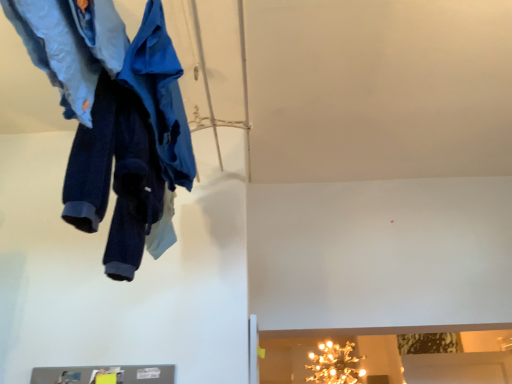
Question: From the image's perspective, is navy blue fleece pants at upper left, which is the second trousers from front to back, positioned above or below blue fabric coat at upper left?

Choices:
 (A) below
 (B) above

Answer: (A)

Question: Do you think navy blue fleece pants at upper left, which is the second trousers from front to back, is within blue fabric coat at upper left, or outside of it?

Choices:
 (A) inside
 (B) outside

Answer: (B)

Question: Which of these objects is positioned farthest from the denim pants at upper left, the 1th trousers from the front?

Choices:
 (A) gold metallic chandelier at upper center
 (B) navy blue fleece pants at upper left, which is the second trousers from front to back
 (C) blue fabric coat at upper left

Answer: (A)

Question: Estimate the real-world distances between objects in this image. Which object is farther from the navy blue fleece pants at upper left, which is the second trousers from front to back?

Choices:
 (A) blue fabric coat at upper left
 (B) gold metallic chandelier at upper center
 (C) denim pants at upper left, the 1th trousers from the front

Answer: (B)